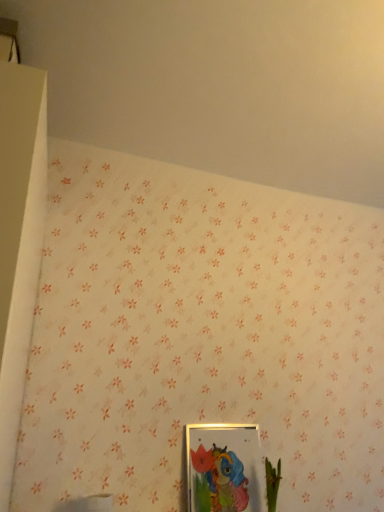
What is the approximate width of metallic gold picture frame at lower center?

It is 2.54 inches.

This screenshot has height=512, width=384. Describe the element at coordinates (223, 468) in the screenshot. I see `metallic gold picture frame at lower center` at that location.

Where is `metallic gold picture frame at lower center`? The image size is (384, 512). metallic gold picture frame at lower center is located at coordinates (223, 468).

Find the location of a particular element. The image size is (384, 512). metallic gold picture frame at lower center is located at coordinates (223, 468).